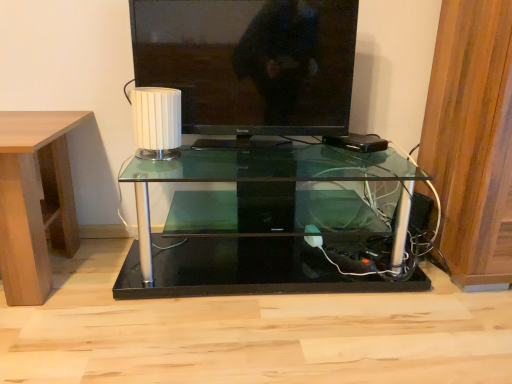
Identify the location of free point above light brown wood at left (from a real-world perspective). The height and width of the screenshot is (384, 512). (28, 122).